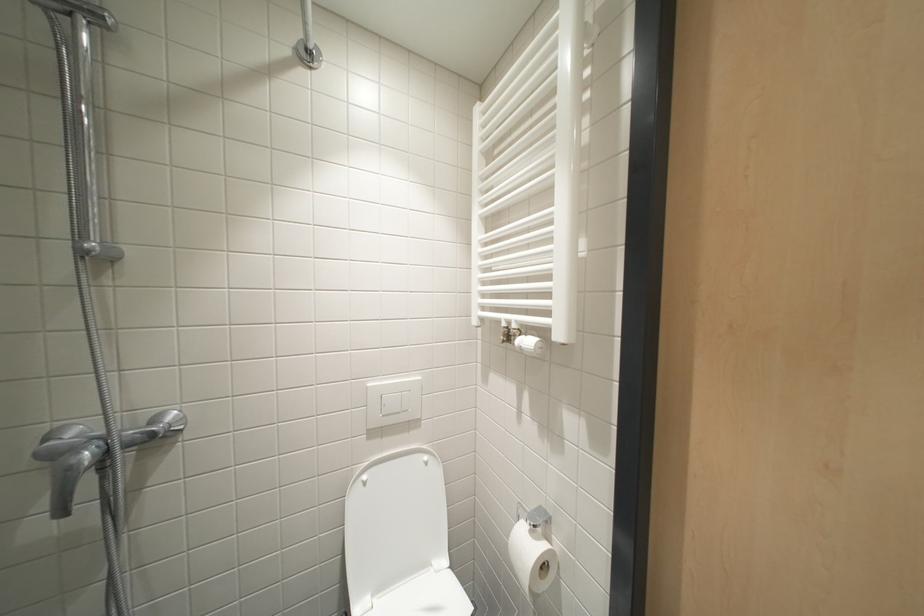
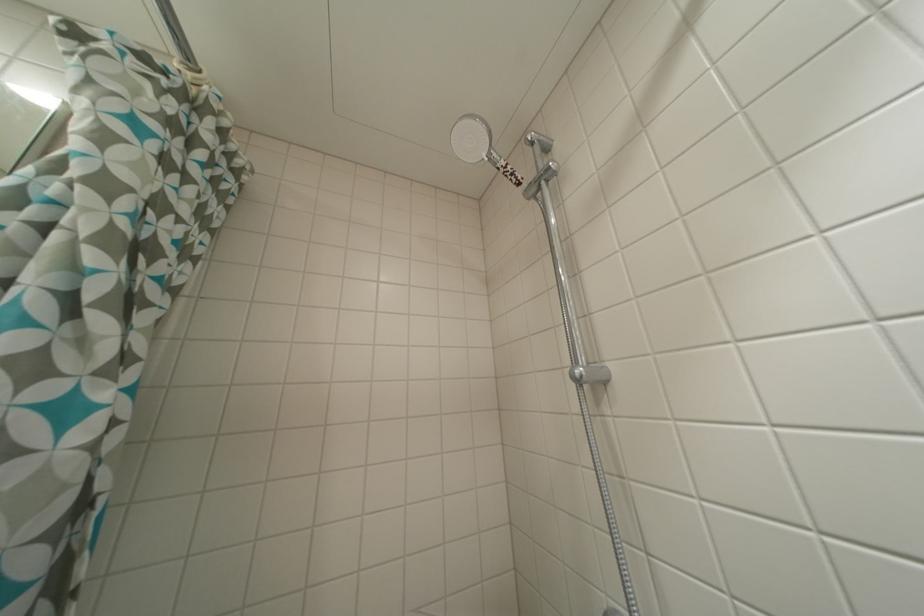
First-person continuous shooting, in which direction is the camera rotating?

The camera's rotation is toward left-up.